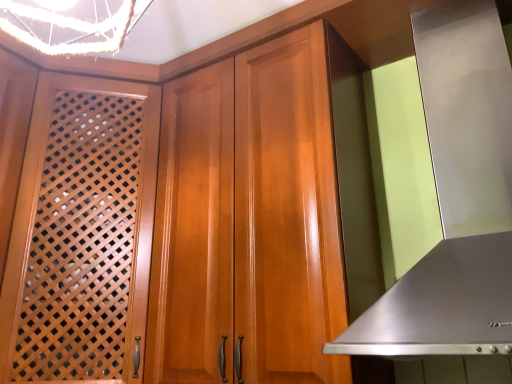
Question: Is wooden lattice screen door at left in front of or behind stainless steel exhaust hood at right in the image?

Choices:
 (A) behind
 (B) front

Answer: (A)

Question: In terms of width, does wooden lattice screen door at left look wider or thinner when compared to stainless steel exhaust hood at right?

Choices:
 (A) thin
 (B) wide

Answer: (B)

Question: From the image's perspective, is wooden lattice screen door at left located above or below stainless steel exhaust hood at right?

Choices:
 (A) above
 (B) below

Answer: (B)

Question: Considering the positions of stainless steel exhaust hood at right and wooden lattice screen door at left in the image, is stainless steel exhaust hood at right taller or shorter than wooden lattice screen door at left?

Choices:
 (A) tall
 (B) short

Answer: (B)

Question: Relative to wooden lattice screen door at left, is stainless steel exhaust hood at right in front or behind?

Choices:
 (A) behind
 (B) front

Answer: (B)

Question: Is stainless steel exhaust hood at right inside the boundaries of wooden lattice screen door at left, or outside?

Choices:
 (A) outside
 (B) inside

Answer: (A)

Question: From the image's perspective, is stainless steel exhaust hood at right positioned above or below wooden lattice screen door at left?

Choices:
 (A) above
 (B) below

Answer: (A)